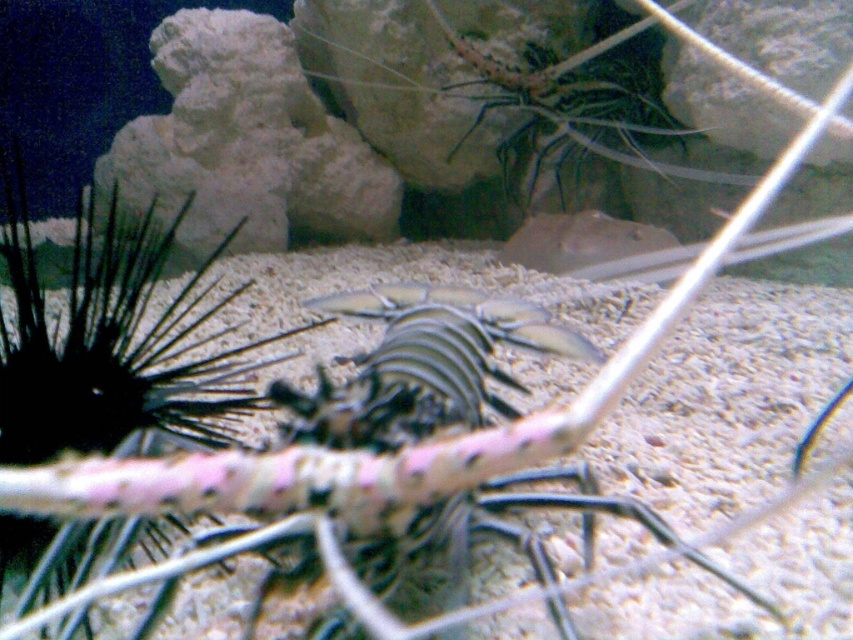
Question: Does shiny black lobster at center appear over translucent glass shrimp at upper center?

Choices:
 (A) yes
 (B) no

Answer: (B)

Question: Which of the following is the closest to the observer?

Choices:
 (A) translucent glass shrimp at upper center
 (B) shiny black lobster at center

Answer: (B)

Question: Can you confirm if shiny black lobster at center is positioned below translucent glass shrimp at upper center?

Choices:
 (A) no
 (B) yes

Answer: (B)

Question: Which point is closer to the camera taking this photo?

Choices:
 (A) (477, 148)
 (B) (460, 529)

Answer: (B)

Question: Which object appears closest to the camera in this image?

Choices:
 (A) shiny black lobster at center
 (B) translucent glass shrimp at upper center

Answer: (A)

Question: Where is shiny black lobster at center located in relation to translucent glass shrimp at upper center in the image?

Choices:
 (A) below
 (B) above

Answer: (A)